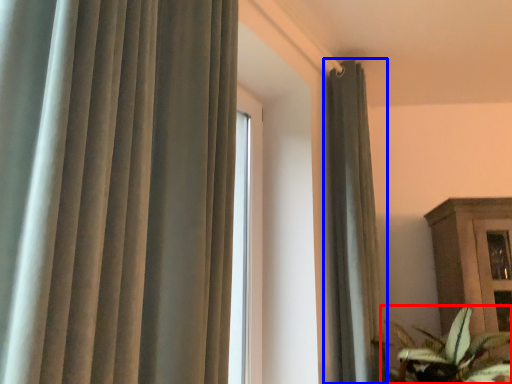
Question: Among these objects, which one is farthest to the camera, houseplant (highlighted by a red box) or curtain (highlighted by a blue box)?

Choices:
 (A) houseplant
 (B) curtain

Answer: (B)